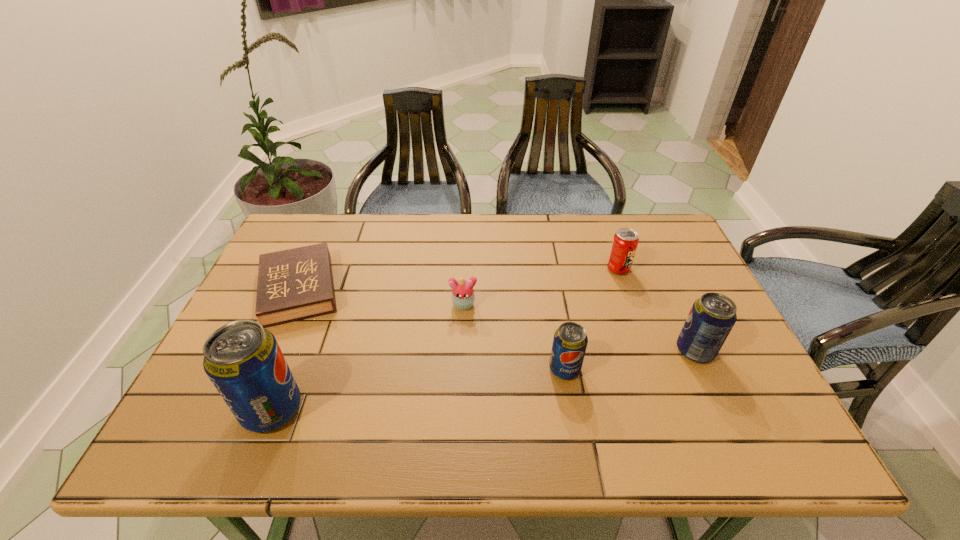
At what (x,y) coordinates should I click in order to perform the action: click on object present at the far left corner. Please return your answer as a coordinate pair (x, y). This screenshot has width=960, height=540. Looking at the image, I should click on (297, 283).

Locate an element on the screen. object that is at the near left corner is located at coordinates (243, 360).

This screenshot has width=960, height=540. I want to click on vacant space at the far edge of the desktop, so click(x=360, y=249).

You are a GUI agent. You are given a task and a screenshot of the screen. Output one action in this format:
    pyautogui.click(x=<x>, y=<y>)
    Task: Click on the free space at the near edge of the desktop
    
    Given the screenshot: What is the action you would take?
    pyautogui.click(x=490, y=401)

Locate an element on the screen. vacant area at the right edge of the desktop is located at coordinates (667, 279).

At what (x,y) coordinates should I click in order to perform the action: click on free spot at the far left corner of the desktop. Please return your answer as a coordinate pair (x, y). The width and height of the screenshot is (960, 540). Looking at the image, I should click on (321, 214).

This screenshot has width=960, height=540. In the image, there is a desktop. Find the location of `free region at the near left corner`. free region at the near left corner is located at coordinates (208, 412).

What are the coordinates of `vacant space at the far right corner of the desktop` in the screenshot? It's located at (644, 215).

At what (x,y) coordinates should I click in order to perform the action: click on vacant space in between the third soda can from left to right and the nearest soda can. Please return your answer as a coordinate pair (x, y). This screenshot has width=960, height=540. Looking at the image, I should click on (444, 339).

I want to click on free space between the farthest soda can and the fourth object from left to right, so 591,319.